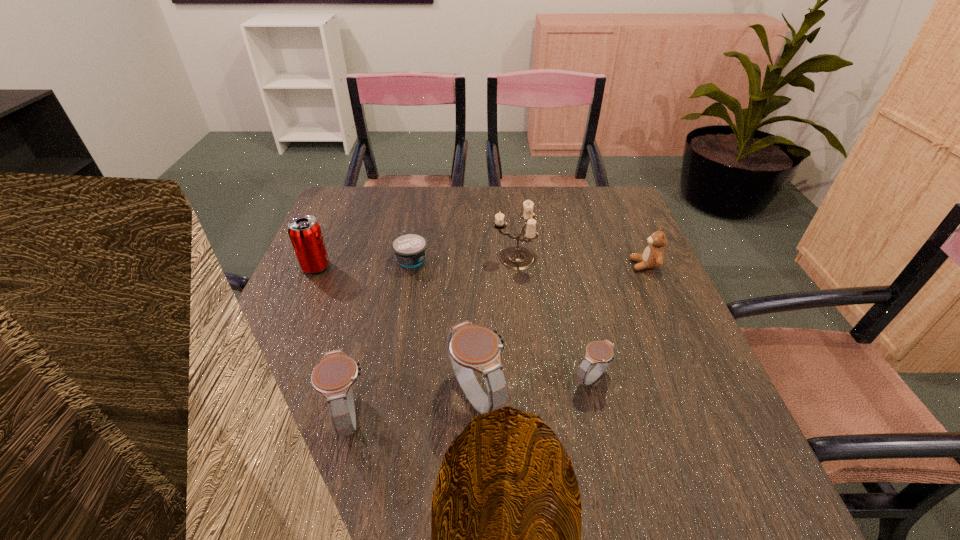
Considering the uniform spacing of watchs, where should an additional watch be positioned on the right? Please locate a free spot. Please provide its 2D coordinates. Your answer should be formatted as a tuple, i.e. [(x, y)], where the tuple contains the x and y coordinates of a point satisfying the conditions above.

[(701, 362)]